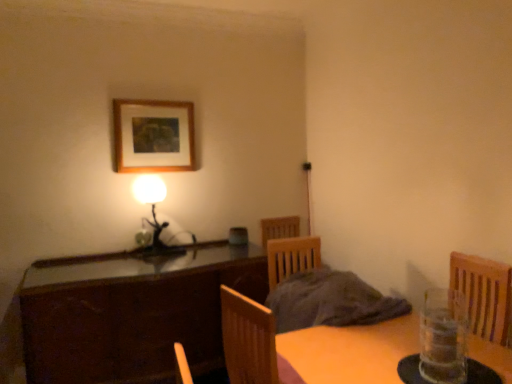
Question: From the image's perspective, is dark wood cabinet at center under matte black lamp at left?

Choices:
 (A) yes
 (B) no

Answer: (A)

Question: From the image's perspective, is dark wood cabinet at center on matte black lamp at left?

Choices:
 (A) no
 (B) yes

Answer: (A)

Question: Can you see dark wood cabinet at center touching matte black lamp at left?

Choices:
 (A) no
 (B) yes

Answer: (A)

Question: Is dark wood cabinet at center smaller than matte black lamp at left?

Choices:
 (A) yes
 (B) no

Answer: (B)

Question: Is dark wood cabinet at center not near matte black lamp at left?

Choices:
 (A) no
 (B) yes

Answer: (A)

Question: Is matte black lamp at left at the back of dark wood cabinet at center?

Choices:
 (A) yes
 (B) no

Answer: (B)

Question: Does matte black lamp at left have a lesser height compared to dark wood cabinet at center?

Choices:
 (A) no
 (B) yes

Answer: (B)

Question: Is matte black lamp at left with dark wood cabinet at center?

Choices:
 (A) no
 (B) yes

Answer: (A)

Question: Is dark wood cabinet at center surrounded by matte black lamp at left?

Choices:
 (A) yes
 (B) no

Answer: (B)

Question: From a real-world perspective, is matte black lamp at left under dark wood cabinet at center?

Choices:
 (A) no
 (B) yes

Answer: (A)

Question: Considering the relative sizes of matte black lamp at left and dark wood cabinet at center in the image provided, is matte black lamp at left bigger than dark wood cabinet at center?

Choices:
 (A) no
 (B) yes

Answer: (A)

Question: Is matte black lamp at left outside dark wood cabinet at center?

Choices:
 (A) no
 (B) yes

Answer: (B)

Question: Is clear glass vase at lower right far away from matte black lamp at left?

Choices:
 (A) yes
 (B) no

Answer: (A)